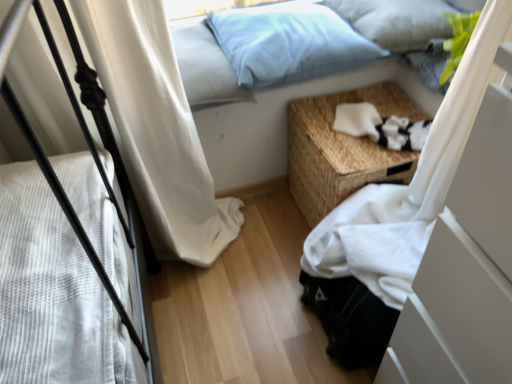
This screenshot has width=512, height=384. Find the location of `vacant space situated on the left part of woven wood nightstand at lower right`. vacant space situated on the left part of woven wood nightstand at lower right is located at coordinates (257, 237).